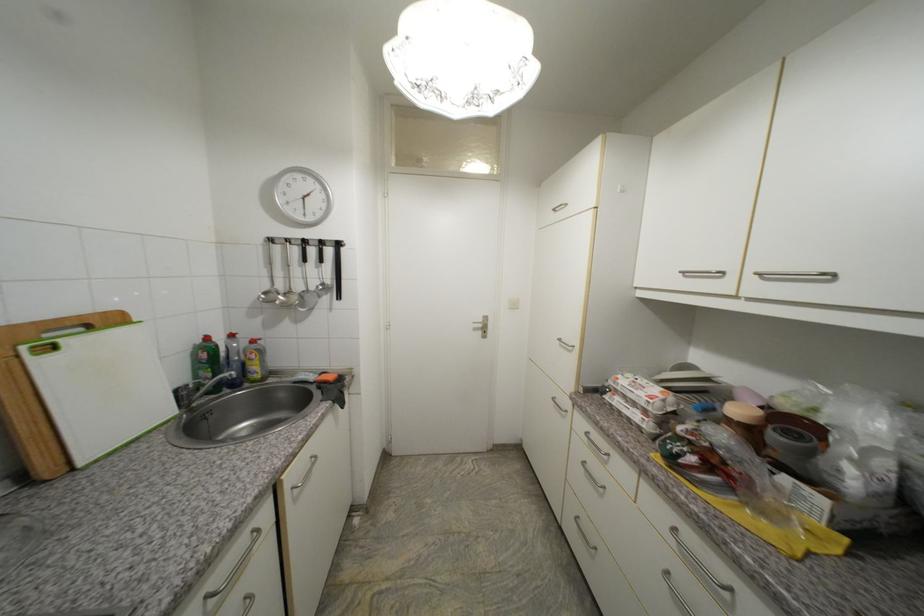
Describe the element at coordinates (210, 386) in the screenshot. The height and width of the screenshot is (616, 924). I see `the faucet handle` at that location.